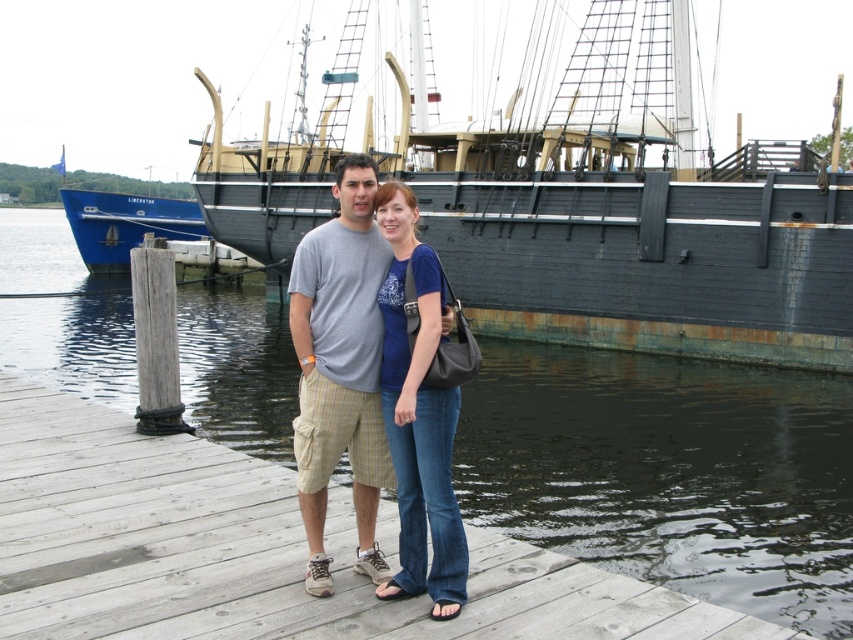
Question: Can you confirm if dark water at dock center is bigger than rusty wooden ship at center?

Choices:
 (A) yes
 (B) no

Answer: (A)

Question: Can you confirm if rusty wooden ship at center is positioned below blue jeans at center?

Choices:
 (A) yes
 (B) no

Answer: (B)

Question: Which point is closer to the camera?

Choices:
 (A) (407, 195)
 (B) (718, 252)

Answer: (A)

Question: Considering the real-world distances, which object is farthest from the rusty wooden ship at center?

Choices:
 (A) gray cotton t-shirt at center
 (B) blue jeans at center
 (C) dark water at dock center

Answer: (A)

Question: Is dark water at dock center wider than gray cotton t-shirt at center?

Choices:
 (A) yes
 (B) no

Answer: (A)

Question: Based on their relative distances, which object is farther from the blue jeans at center?

Choices:
 (A) gray cotton t-shirt at center
 (B) rusty wooden ship at center

Answer: (B)